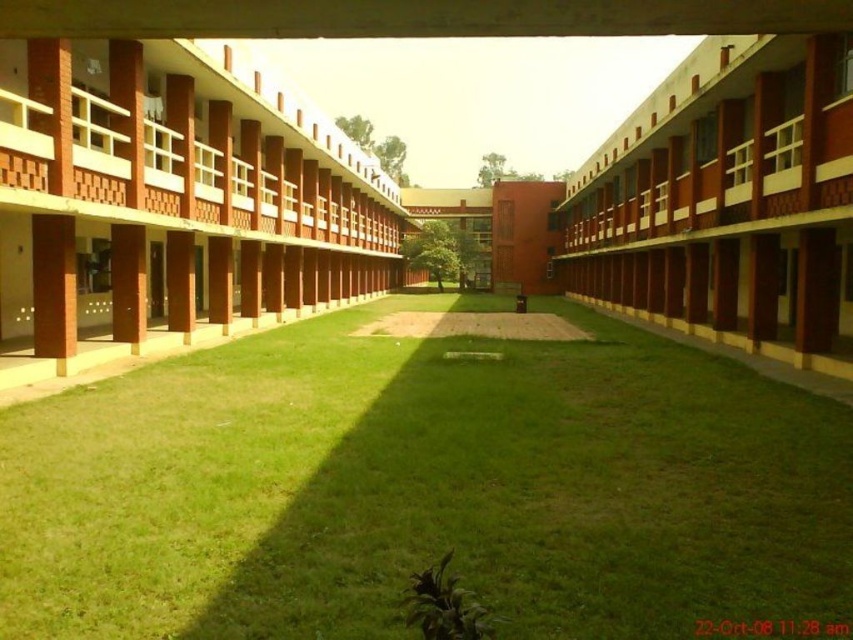
Question: Is matte brick building at left further to the viewer compared to matte brick building at center?

Choices:
 (A) no
 (B) yes

Answer: (A)

Question: Which is nearer to the matte brick building at left?

Choices:
 (A) matte brick building at center
 (B) green grass at center

Answer: (B)

Question: Which point appears closest to the camera in this image?

Choices:
 (A) (675, 243)
 (B) (192, 416)
 (C) (357, 228)

Answer: (B)

Question: Based on their relative distances, which object is nearer to the matte brick building at left?

Choices:
 (A) green grass at center
 (B) matte brick building at center

Answer: (A)

Question: From the image, what is the correct spatial relationship of green grass at center in relation to matte brick building at left?

Choices:
 (A) above
 (B) below

Answer: (B)

Question: In this image, where is matte brick building at left located relative to matte brick building at center?

Choices:
 (A) right
 (B) left

Answer: (B)